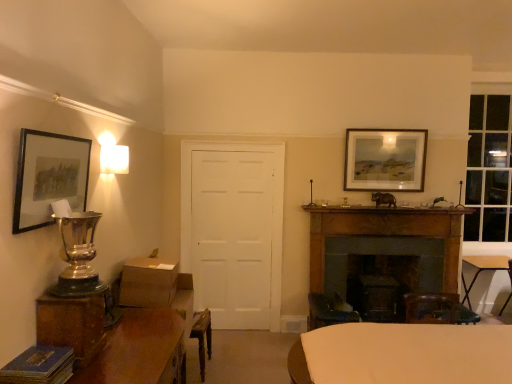
Locate an element on the screen. The width and height of the screenshot is (512, 384). vacant space in matte wooden picture frame at upper right, which is the first picture frame from back to front (from a real-world perspective) is located at coordinates (388, 209).